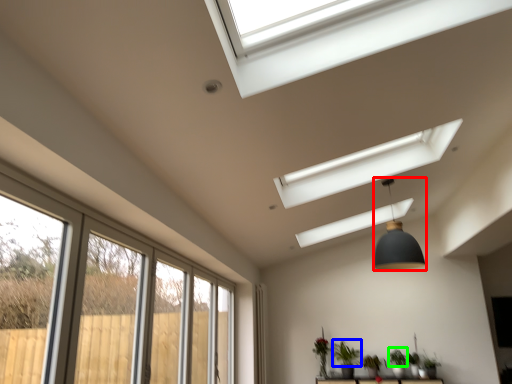
Question: Which object is the farthest from light fixture (highlighted by a red box)? Choose among these: plant (highlighted by a blue box) or plant (highlighted by a green box).

Choices:
 (A) plant
 (B) plant

Answer: (B)